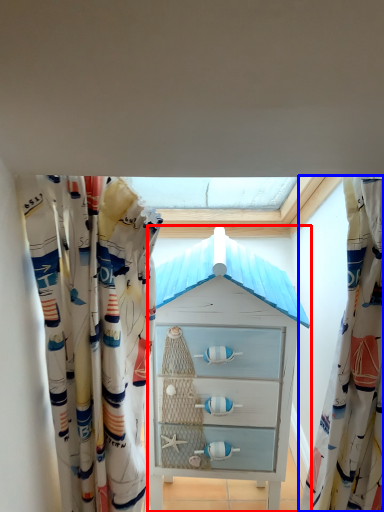
Question: Which of the following is the farthest to the observer, chest of drawers (highlighted by a red box) or curtain (highlighted by a blue box)?

Choices:
 (A) chest of drawers
 (B) curtain

Answer: (A)